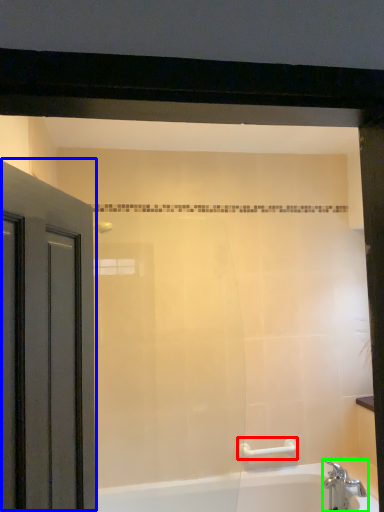
Question: Which object is the closest to the towel bar (highlighted by a red box)? Choose among these: door (highlighted by a blue box) or tap (highlighted by a green box).

Choices:
 (A) door
 (B) tap

Answer: (B)